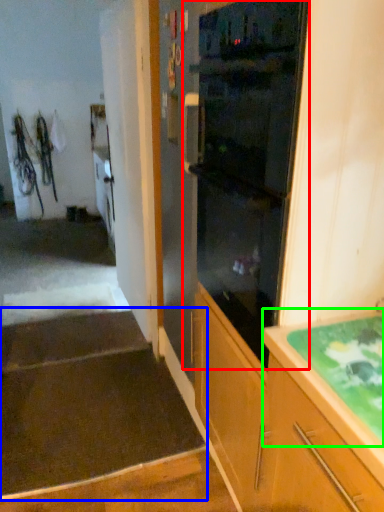
Question: Considering the real-world distances, which object is closest to home appliance (highlighted by a red box)? stairwell (highlighted by a blue box) or countertop (highlighted by a green box).

Choices:
 (A) stairwell
 (B) countertop

Answer: (B)